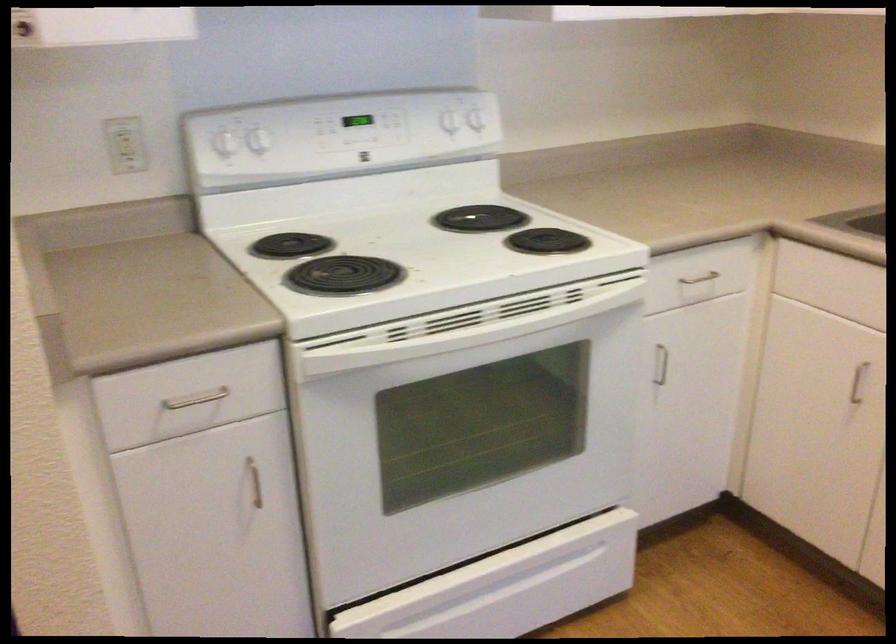
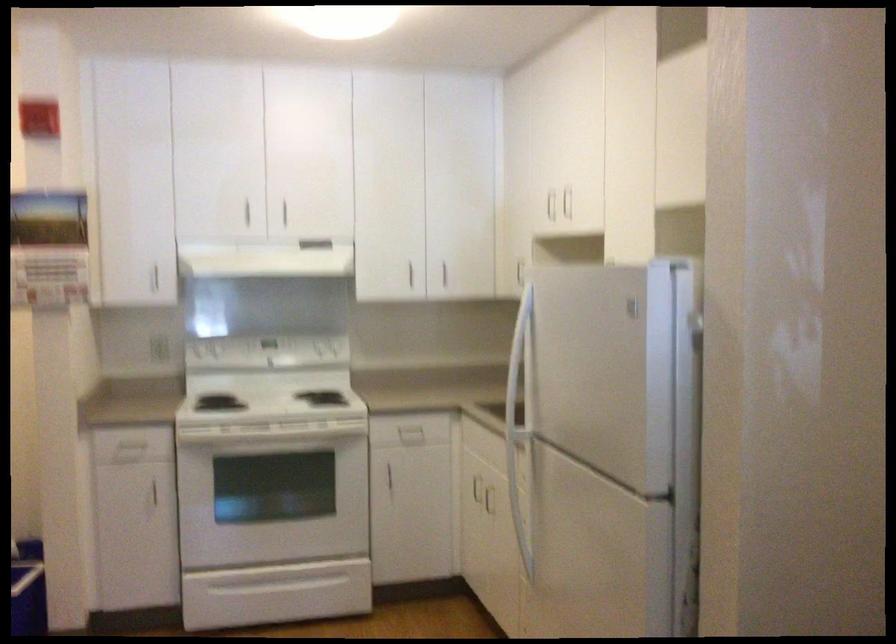
What movement of the cameraman would produce the second image?

The cameraman moved toward right, backward.